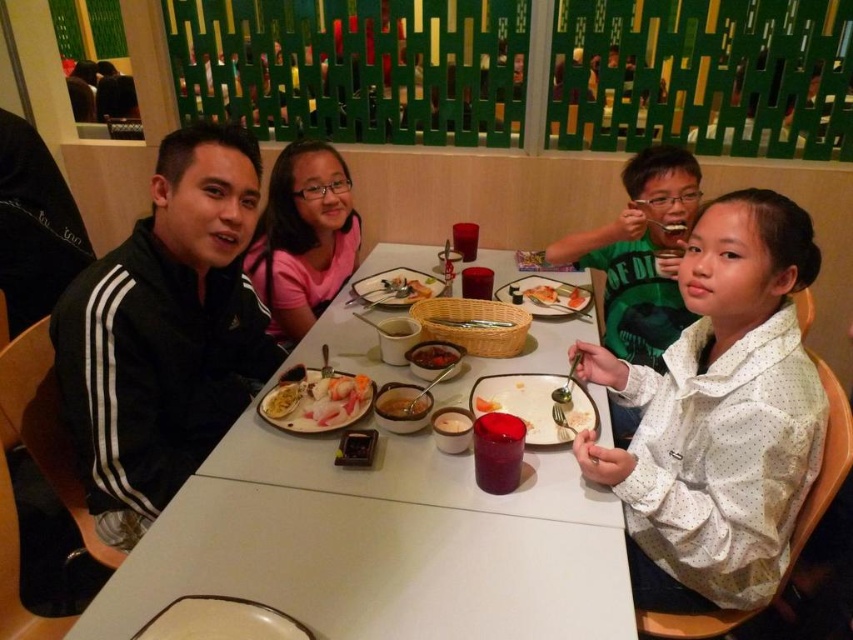
You are a food photographer and want to capture the arrangement of the slightly glossy dark red sauce at center and the smooth white rice at center. Which one is positioned higher on the table?

The slightly glossy dark red sauce at center is located above the smooth white rice at center, so it is positioned higher on the table.

You are a food critic who needs to describe the arrangement of the dishes on the table. Which object is wider, the smooth white rice at center or the orange matte sushi at center?

The smooth white rice at center might be wider than orange matte sushi at center according to the description provided.

You are a food critic evaluating the presentation of this meal. The dish has both the slightly glossy dark red sauce at center and the smooth white rice at center. Which component occupies a larger portion of the plate?

The slightly glossy dark red sauce at center is larger in size than the smooth white rice at center, so it occupies a larger portion of the plate.